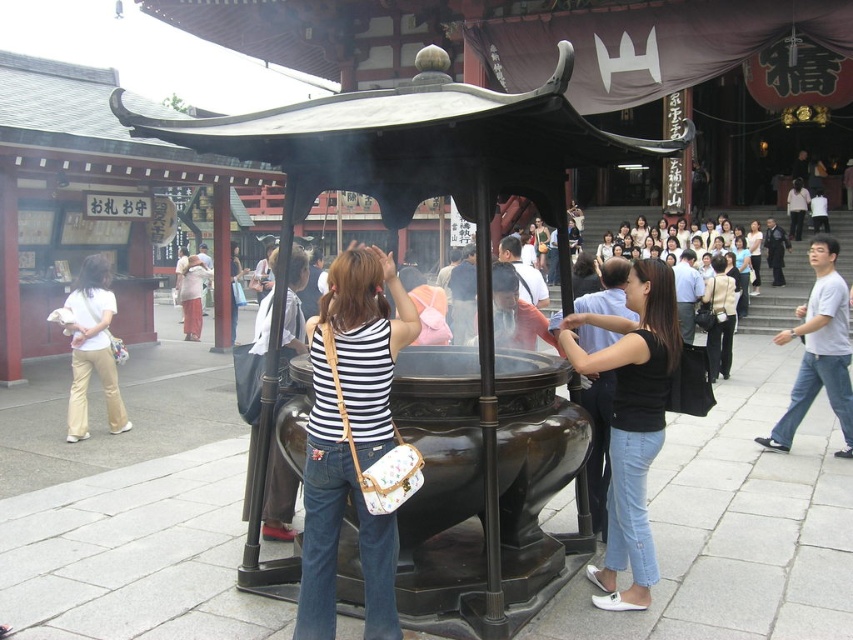
Looking at this image, you are a photographer at the temple and want to capture a shot of the striped fabric shirt at center and dark gray pants at center. Which clothing item is shorter in length?

The striped fabric shirt at center is shorter than dark gray pants at center.

You are standing at the shrine and want to place a small offering. There are two points marked in the scene where you can place it. The first point is at coordinate point (x=674, y=342) and the second is at point (x=99, y=330). Which point is closer to you?

Point (x=674, y=342) is closer to the viewer than point (x=99, y=330), so you should place the offering there.